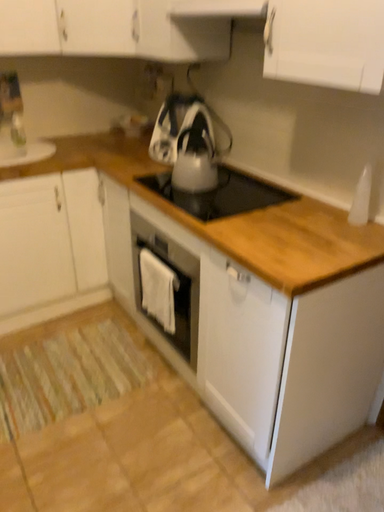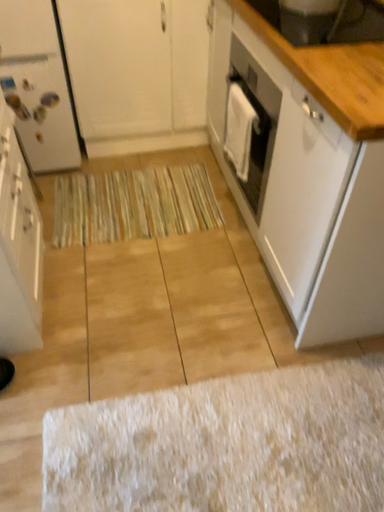
Question: How did the camera likely rotate when shooting the video?

Choices:
 (A) rotated left
 (B) rotated right

Answer: (A)